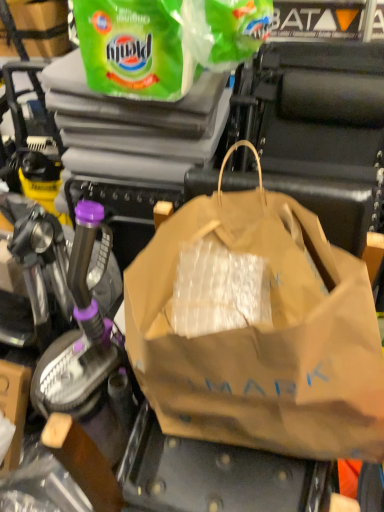
Question: Considering the positions of brown paper bag at center, arranged as the 2th plastic bag when viewed from the top, and green plastic bag at upper center, arranged as the 1th plastic bag when viewed from the top, in the image, is brown paper bag at center, arranged as the 2th plastic bag when viewed from the top, taller or shorter than green plastic bag at upper center, arranged as the 1th plastic bag when viewed from the top,?

Choices:
 (A) tall
 (B) short

Answer: (A)

Question: Is brown paper bag at center, arranged as the 2th plastic bag when viewed from the top, to the left or to the right of green plastic bag at upper center, which ranks as the 2th plastic bag in bottom-to-top order, in the image?

Choices:
 (A) right
 (B) left

Answer: (A)

Question: From the image's perspective, is brown paper bag at center, arranged as the 2th plastic bag when viewed from the top, above or below green plastic bag at upper center, arranged as the 1th plastic bag when viewed from the top?

Choices:
 (A) below
 (B) above

Answer: (A)

Question: In terms of height, does green plastic bag at upper center, which ranks as the 2th plastic bag in bottom-to-top order, look taller or shorter compared to brown paper bag at center, which is the first plastic bag from bottom to top?

Choices:
 (A) tall
 (B) short

Answer: (B)

Question: From the image's perspective, is green plastic bag at upper center, which ranks as the 2th plastic bag in bottom-to-top order, positioned above or below brown paper bag at center, which is the first plastic bag from bottom to top?

Choices:
 (A) below
 (B) above

Answer: (B)

Question: Is point (132, 53) closer or farther from the camera than point (339, 292)?

Choices:
 (A) closer
 (B) farther

Answer: (B)

Question: Is green plastic bag at upper center, which ranks as the 2th plastic bag in bottom-to-top order, situated inside brown paper bag at center, arranged as the 2th plastic bag when viewed from the top, or outside?

Choices:
 (A) inside
 (B) outside

Answer: (B)